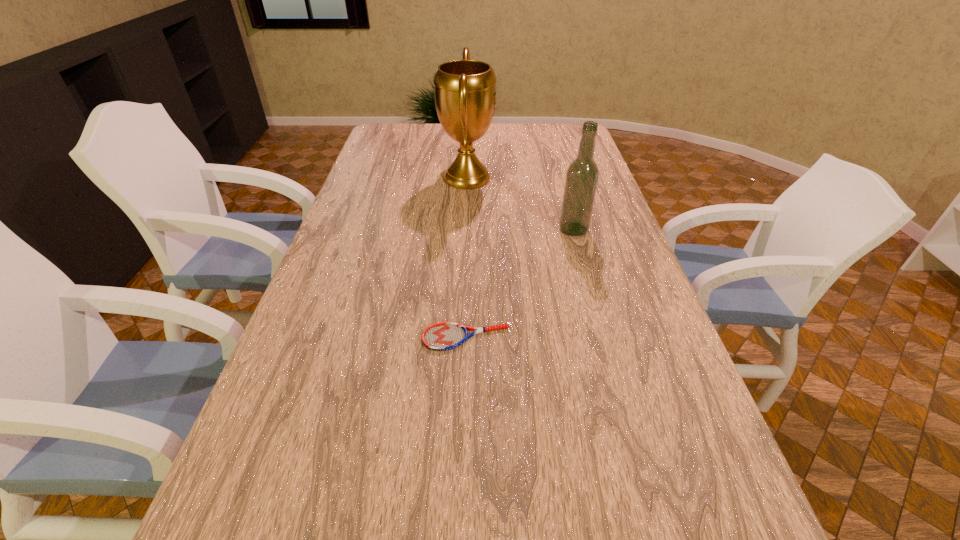
Where is `empty space that is in between the tallest object and the shortest object`? The width and height of the screenshot is (960, 540). empty space that is in between the tallest object and the shortest object is located at coordinates (467, 258).

Where is `free point between the second tallest object and the shortest object`? This screenshot has height=540, width=960. free point between the second tallest object and the shortest object is located at coordinates (519, 284).

At what (x,y) coordinates should I click in order to perform the action: click on vacant area that lies between the second shortest object and the farthest object. Please return your answer as a coordinate pair (x, y). Looking at the image, I should click on (520, 204).

Find the location of a particular element. object that ranks as the second closest to the nearest object is located at coordinates (465, 92).

Identify which object is the closest to the farthest object. Please provide its 2D coordinates. Your answer should be formatted as a tuple, i.e. [(x, y)], where the tuple contains the x and y coordinates of a point satisfying the conditions above.

[(582, 175)]

This screenshot has height=540, width=960. Find the location of `vacant position in the image that satisfies the following two spatial constraints: 1. on the surface of the tallest object with symbols; 2. on the left side of the liquor`. vacant position in the image that satisfies the following two spatial constraints: 1. on the surface of the tallest object with symbols; 2. on the left side of the liquor is located at coordinates (465, 230).

At what (x,y) coordinates should I click in order to perform the action: click on free space in the image that satisfies the following two spatial constraints: 1. on the surface of the tallest object with symbols; 2. on the back side of the shortest object. Please return your answer as a coordinate pair (x, y). The image size is (960, 540). Looking at the image, I should click on (460, 338).

Where is `vacant point that satisfies the following two spatial constraints: 1. on the surface of the trophy cup with symbols; 2. on the left side of the second farthest object`? The image size is (960, 540). vacant point that satisfies the following two spatial constraints: 1. on the surface of the trophy cup with symbols; 2. on the left side of the second farthest object is located at coordinates (465, 230).

I want to click on vacant position in the image that satisfies the following two spatial constraints: 1. on the surface of the farthest object with symbols; 2. on the right side of the nearest object, so click(460, 338).

The height and width of the screenshot is (540, 960). In order to click on free space that satisfies the following two spatial constraints: 1. on the surface of the tallest object with symbols; 2. on the left side of the second farthest object in this screenshot , I will do `click(465, 230)`.